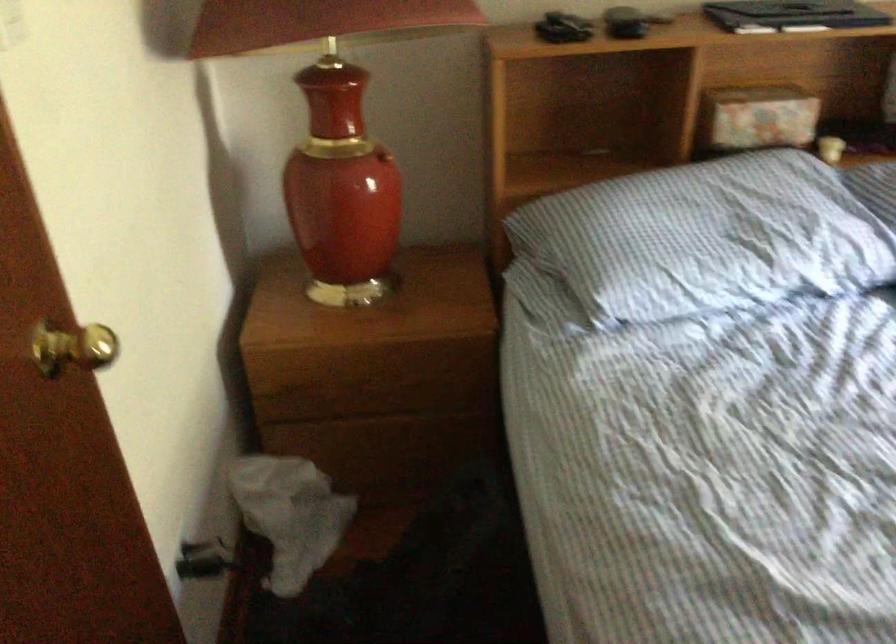
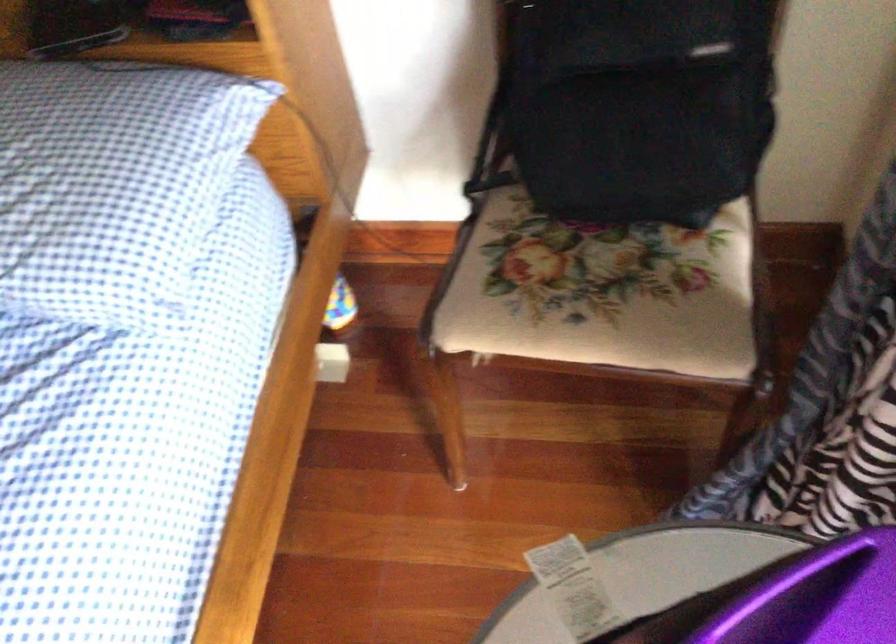
Question: In a continuous first-person perspective shot, in which direction is the camera moving?

Choices:
 (A) Left
 (B) Right
 (C) Forward
 (D) Backward

Answer: (B)